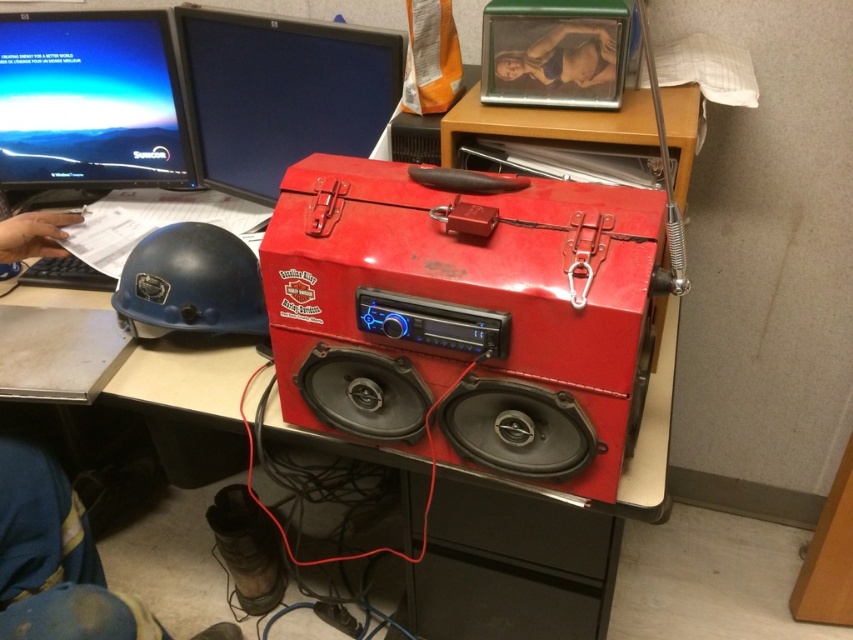
Question: Which point is closer to the camera taking this photo?

Choices:
 (A) (194, 250)
 (B) (184, 170)
 (C) (287, 106)
 (D) (381, 316)

Answer: (D)

Question: Is matte black monitor at upper center positioned in front of blue hard plastic helmet at left?

Choices:
 (A) yes
 (B) no

Answer: (B)

Question: Which point is closer to the camera?

Choices:
 (A) matte black monitor at upper left
 (B) matte black monitor at upper center
 (C) glossy plastic speaker at center
 (D) blue hard plastic helmet at left

Answer: (C)

Question: Is matte black monitor at upper left bigger than blue hard plastic helmet at left?

Choices:
 (A) yes
 (B) no

Answer: (A)

Question: Is glossy plastic speaker at center smaller than matte black monitor at upper left?

Choices:
 (A) yes
 (B) no

Answer: (B)

Question: Which point is farther to the camera?

Choices:
 (A) glossy plastic speaker at center
 (B) matte black monitor at upper center

Answer: (B)